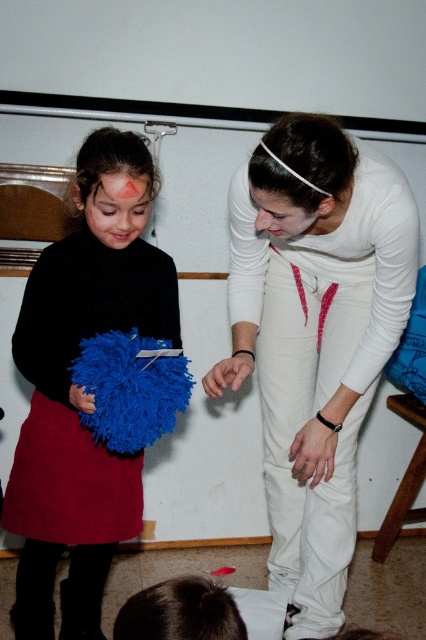
Question: Does white matte pants at center appear over velvety blue pom-pom at left?

Choices:
 (A) no
 (B) yes

Answer: (B)

Question: Which point is farther to the camera?

Choices:
 (A) (25, 372)
 (B) (91, 378)
 (C) (351, 262)

Answer: (C)

Question: Can you confirm if white matte pants at center is positioned below velvety blue pom-pom at left?

Choices:
 (A) yes
 (B) no

Answer: (B)

Question: Which object is the farthest from the velvety blue pom-pom at left?

Choices:
 (A) white matte pants at center
 (B) fuzzy blue heart at lower left

Answer: (A)

Question: From the image, what is the correct spatial relationship of white matte pants at center in relation to velvety blue pom-pom at left?

Choices:
 (A) above
 (B) below

Answer: (A)

Question: Among these objects, which one is farthest from the camera?

Choices:
 (A) white matte pants at center
 (B) fuzzy blue heart at lower left
 (C) velvety blue pom-pom at left

Answer: (C)